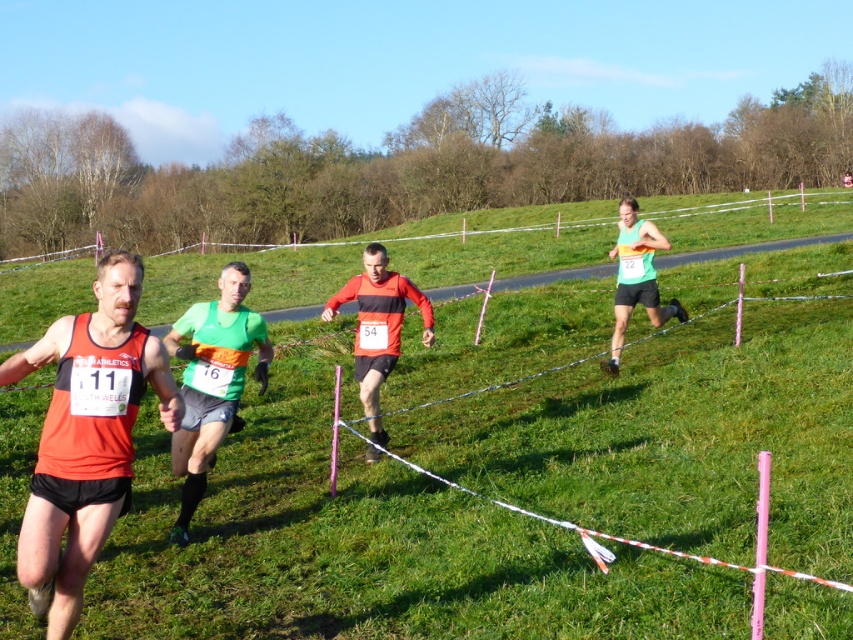
You are a photographer positioned at the starting line of the cross country race. You want to take a photo that includes both the green grassy at center and the green fabric shorts at center. Which object will appear larger in your photo?

The green grassy at center will appear larger in the photo because it is closer to the viewer than the green fabric shorts at center.

You are a race organizer and need to place a water station at the point with coordinates point (364, 541). According to the scene description, what terrain will the water station be placed on?

The point (364, 541) corresponds to green grassy at center, so the water station will be placed on green grassy terrain at the center of the scene.